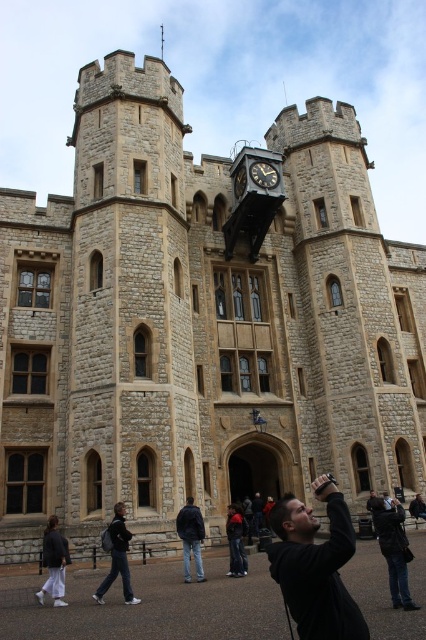
You are a tourist visiting the castle and want to take a photo of the dark brown wooden clock at center. However, there is a dark gray jacket at lower right in the way. Can you still take a clear photo of the clock without the jacket blocking it?

The dark gray jacket at lower right is bigger than the dark brown wooden clock at center, so the jacket may block part of the clock. Move to the side to avoid the jacket for a clear view.

You are a visitor standing in front of the historic stone building. You notice two items on the ground near the entrance. The dark gray jacket at lower right and the white cotton pants at lower left. Which item is shorter in height?

The dark gray jacket at lower right has a lesser height compared to white cotton pants at lower left, so the dark gray jacket at lower right is shorter in height.